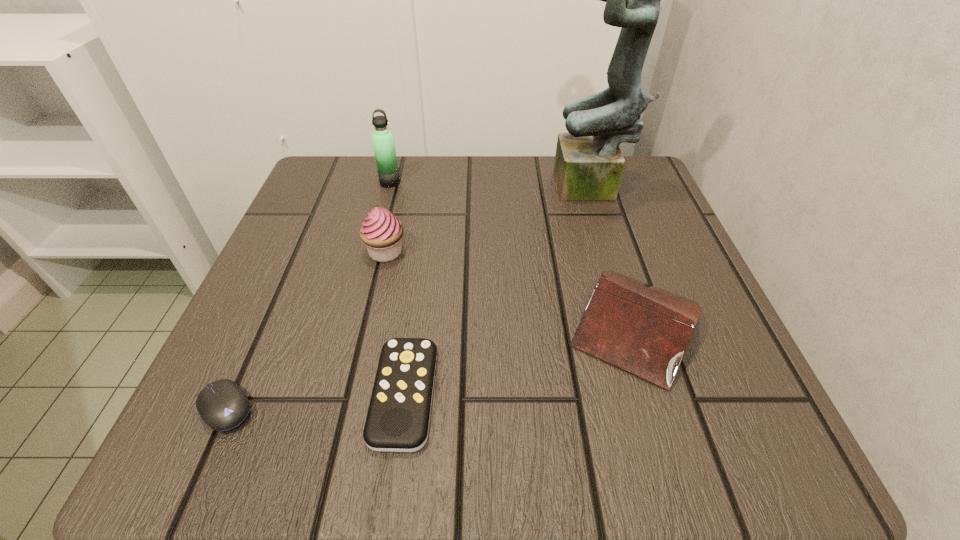
Where is `free location located on the right of the thermos bottle`? free location located on the right of the thermos bottle is located at coordinates (483, 182).

You are a GUI agent. You are given a task and a screenshot of the screen. Output one action in this format:
    pyautogui.click(x=<x>, y=<y>)
    Task: Click on the free space located on the right of the fourth shortest object
    This screenshot has height=540, width=960.
    Given the screenshot: What is the action you would take?
    pyautogui.click(x=490, y=252)

I want to click on vacant region located on the left of the book, so click(x=396, y=325).

Locate an element on the screen. Image resolution: width=960 pixels, height=540 pixels. vacant space located 0.160m on the right of the leftmost object is located at coordinates (377, 408).

This screenshot has height=540, width=960. Identify the location of vacant space positioned on the back of the remote control. (421, 266).

At what (x,y) coordinates should I click in order to perform the action: click on sculpture positioned at the far edge. Please return your answer as a coordinate pair (x, y). Looking at the image, I should click on coord(589,164).

This screenshot has height=540, width=960. I want to click on thermos bottle located in the far edge section of the desktop, so point(383,141).

You are a GUI agent. You are given a task and a screenshot of the screen. Output one action in this format:
    pyautogui.click(x=<x>, y=<y>)
    Task: Click on the computer mouse at the near edge
    
    Given the screenshot: What is the action you would take?
    pyautogui.click(x=223, y=405)

Identify the location of remote control present at the near edge. This screenshot has width=960, height=540. (398, 418).

Where is `thermos bottle that is positioned at the left edge`? The image size is (960, 540). thermos bottle that is positioned at the left edge is located at coordinates (383, 141).